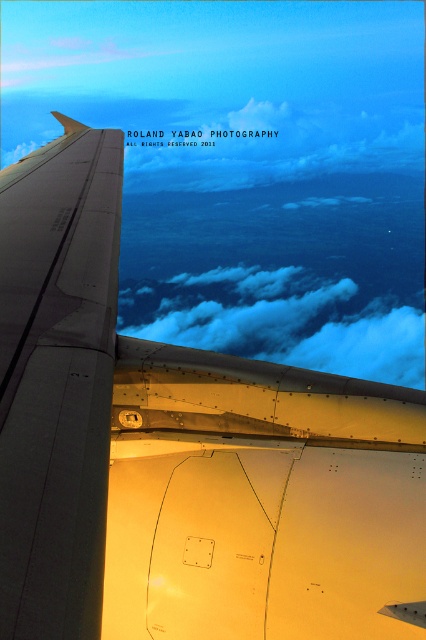
Who is positioned more to the right, matte gray wing at left or cloudy sky at upper center?

From the viewer's perspective, cloudy sky at upper center appears more on the right side.

Who is more forward, (97, 566) or (230, 344)?

Point (97, 566) is more forward.

Find the location of a particular element. This screenshot has height=640, width=426. matte gray wing at left is located at coordinates (57, 380).